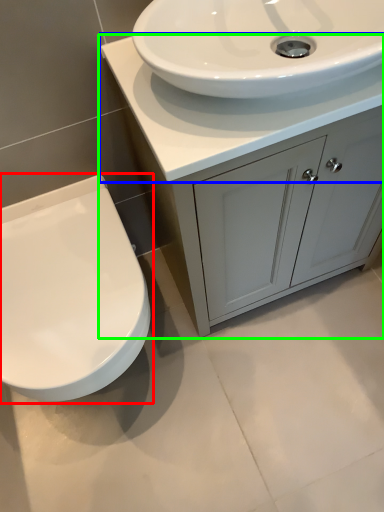
Question: Considering the real-world distances, which object is closest to toilet (highlighted by a red box)? counter top (highlighted by a blue box) or bathroom cabinet (highlighted by a green box).

Choices:
 (A) counter top
 (B) bathroom cabinet

Answer: (B)